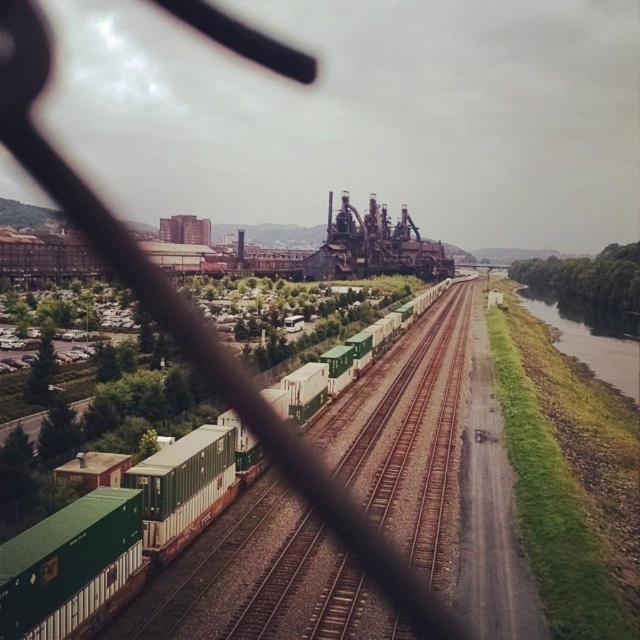
Question: Which point appears closest to the camera in this image?

Choices:
 (A) (609, 349)
 (B) (164, 545)

Answer: (B)

Question: Which of the following is the farthest from the observer?

Choices:
 (A) green matte container at left
 (B) green grassy river at right

Answer: (B)

Question: Does green grassy river at right have a larger size compared to green matte container at left?

Choices:
 (A) yes
 (B) no

Answer: (A)

Question: Is green grassy river at right to the right of green matte container at left from the viewer's perspective?

Choices:
 (A) yes
 (B) no

Answer: (A)

Question: Is green grassy river at right positioned before green matte container at left?

Choices:
 (A) no
 (B) yes

Answer: (A)